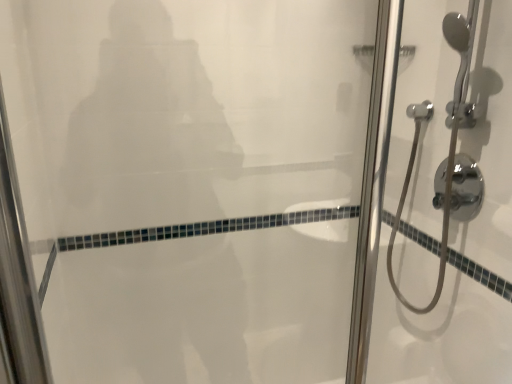
The height and width of the screenshot is (384, 512). I want to click on polished chrome shower at right, so click(x=449, y=146).

Describe the element at coordinates (449, 146) in the screenshot. I see `polished chrome shower at right` at that location.

Measure the distance between polished chrome shower at right and camera.

polished chrome shower at right and camera are 1.08 meters apart from each other.

Locate an element on the screen. polished chrome shower at right is located at coordinates pyautogui.click(x=449, y=146).